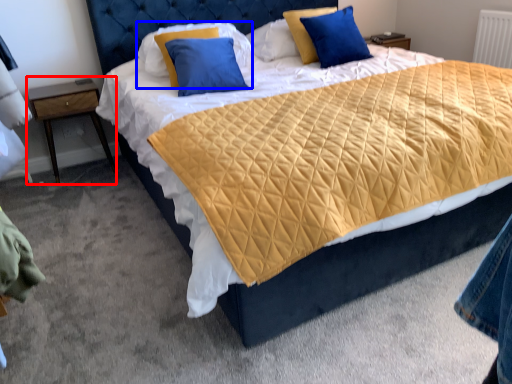
Question: Which point is closer to the camera, nightstand (highlighted by a red box) or pillow (highlighted by a blue box)?

Choices:
 (A) nightstand
 (B) pillow

Answer: (B)